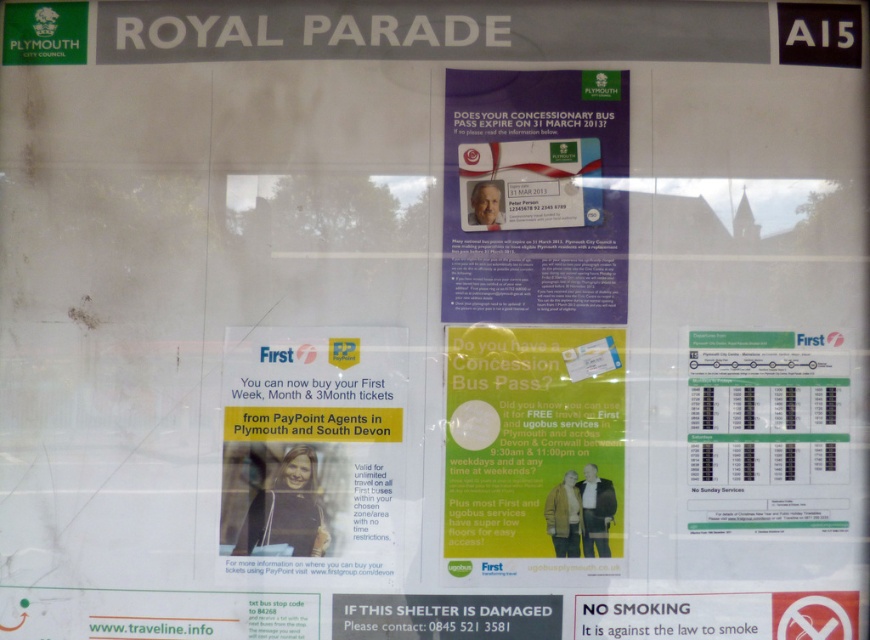
Measure the distance between point (534, 76) and camera.

A distance of 5.67 feet exists between point (534, 76) and camera.

At what (x,y) coordinates should I click in order to perform the action: click on blue paper poster at center. Please return your answer as a coordinate pair (x, y). Looking at the image, I should click on (534, 196).

I want to click on blue paper poster at center, so click(534, 196).

Does matte yellow paper at center have a lesser height compared to green paper poster at center?

No, matte yellow paper at center is not shorter than green paper poster at center.

Is matte yellow paper at center to the right of green paper poster at center from the viewer's perspective?

No, matte yellow paper at center is not to the right of green paper poster at center.

This screenshot has width=870, height=640. What are the coordinates of `matte yellow paper at center` in the screenshot? It's located at (312, 449).

Can you confirm if blue paper poster at center is positioned below green paper poster at center?

No, blue paper poster at center is not below green paper poster at center.

The height and width of the screenshot is (640, 870). What do you see at coordinates (534, 196) in the screenshot?
I see `blue paper poster at center` at bounding box center [534, 196].

The width and height of the screenshot is (870, 640). What are the coordinates of `blue paper poster at center` in the screenshot? It's located at (534, 196).